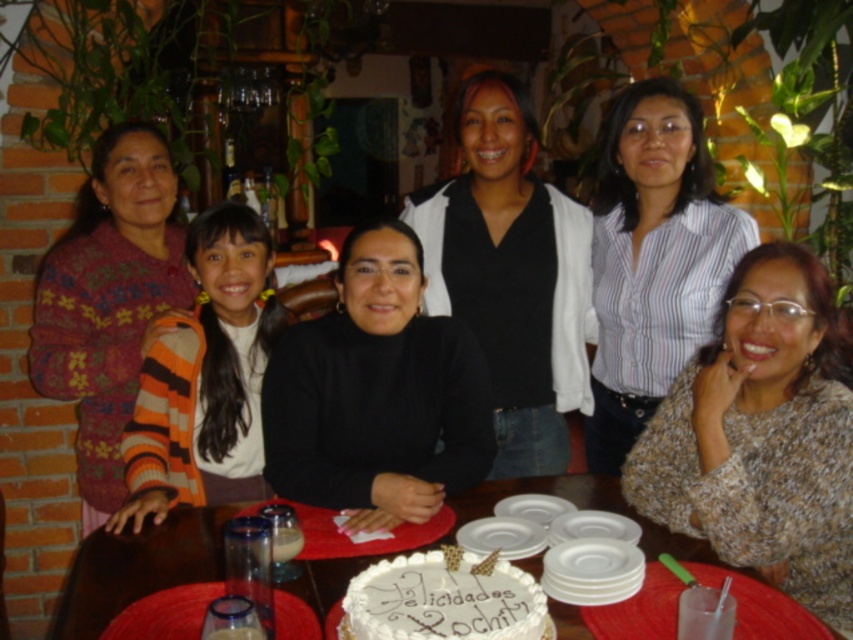
Does knitted beige sweater at center have a greater width compared to white frosted cake at center?

Yes, knitted beige sweater at center is wider than white frosted cake at center.

Between knitted beige sweater at center and white frosted cake at center, which one has less height?

Standing shorter between the two is white frosted cake at center.

Does point (728, 515) come closer to viewer compared to point (376, 634)?

No, (728, 515) is further to viewer.

Where is `knitted beige sweater at center`? Image resolution: width=853 pixels, height=640 pixels. knitted beige sweater at center is located at coordinates (762, 436).

Can you confirm if orange striped sweater at center is taller than white frosted cake at center?

Yes.

What do you see at coordinates (207, 374) in the screenshot? The height and width of the screenshot is (640, 853). I see `orange striped sweater at center` at bounding box center [207, 374].

Find the location of a particular element. Image resolution: width=853 pixels, height=640 pixels. orange striped sweater at center is located at coordinates (207, 374).

The image size is (853, 640). What do you see at coordinates (762, 436) in the screenshot? I see `knitted beige sweater at center` at bounding box center [762, 436].

Does point (809, 413) come farther from viewer compared to point (51, 244)?

No, it is in front of (51, 244).

Is point (820, 396) more distant than point (91, 200)?

No.

The image size is (853, 640). I want to click on knitted beige sweater at center, so click(762, 436).